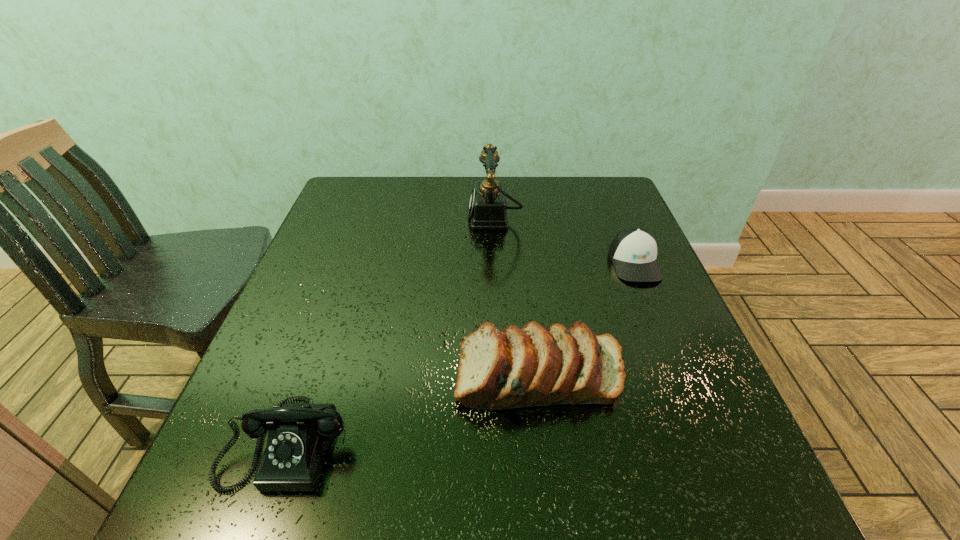
Locate an element on the screen. The height and width of the screenshot is (540, 960). free spot located on the back of the bread is located at coordinates (522, 231).

At what (x,y) coordinates should I click in order to perform the action: click on free space located 0.360m on the front panel of the rightmost object. Please return your answer as a coordinate pair (x, y). The image size is (960, 540). Looking at the image, I should click on (703, 426).

This screenshot has width=960, height=540. In order to click on object situated at the far edge in this screenshot , I will do `click(487, 208)`.

Locate an element on the screen. This screenshot has width=960, height=540. object situated at the near edge is located at coordinates (299, 435).

Find the location of a particular element. This screenshot has height=540, width=960. object that is positioned at the left edge is located at coordinates (299, 435).

Locate an element on the screen. bread located in the right edge section of the desktop is located at coordinates (534, 366).

The width and height of the screenshot is (960, 540). Find the location of `cap present at the right edge`. cap present at the right edge is located at coordinates (x=633, y=251).

Locate an element on the screen. Image resolution: width=960 pixels, height=540 pixels. object situated at the near left corner is located at coordinates (299, 435).

Locate an element on the screen. This screenshot has width=960, height=540. free space at the far edge of the desktop is located at coordinates (554, 198).

Identify the location of free space at the near edge of the desktop. This screenshot has height=540, width=960. (559, 502).